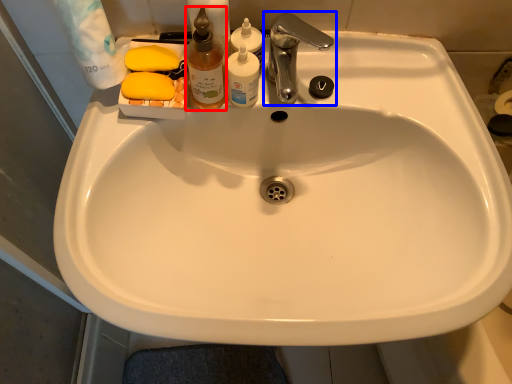
Question: Which object appears closest to the camera in this image, cleaning product (highlighted by a red box) or tap (highlighted by a blue box)?

Choices:
 (A) cleaning product
 (B) tap

Answer: (A)